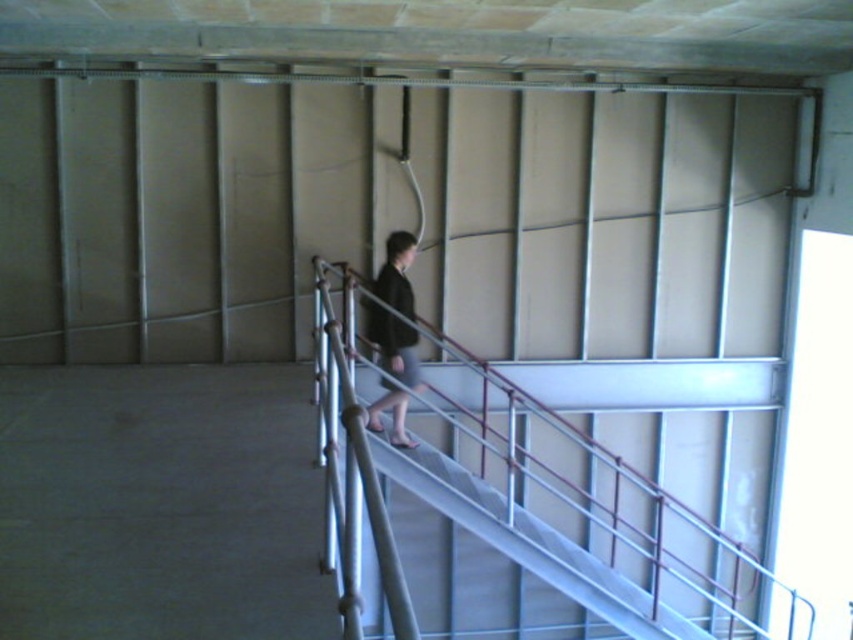
You are a delivery robot with a package that requires a 5 feet wide path to move. You are in the scene and need to navigate between the metallic silver handrail at center and the dark gray fabric dress at center. Can you safely pass through the space between them?

The metallic silver handrail at center and dark gray fabric dress at center are 4.97 feet apart from each other. Since the required path width is 5 feet, the distance is slightly less than needed, so the robot cannot safely pass through the space between them.

In the scene shown: You are a painter standing at the bottom of the staircase. You want to paint the metallic silver handrail at center and the dark gray fabric dress at center. Which object should you look upwards to paint?

The dark gray fabric dress at center is above the metallic silver handrail at center, so you should look upwards to paint the dark gray fabric dress at center.

You are an interior designer assessing the space. You need to place a decorative item that requires a surface wider than the dark gray fabric dress at center. Can the metallic silver handrail at center accommodate it?

The metallic silver handrail at center has a width larger than the dark gray fabric dress at center, so it can accommodate the decorative item requiring a surface wider than the dark gray fabric dress at center.